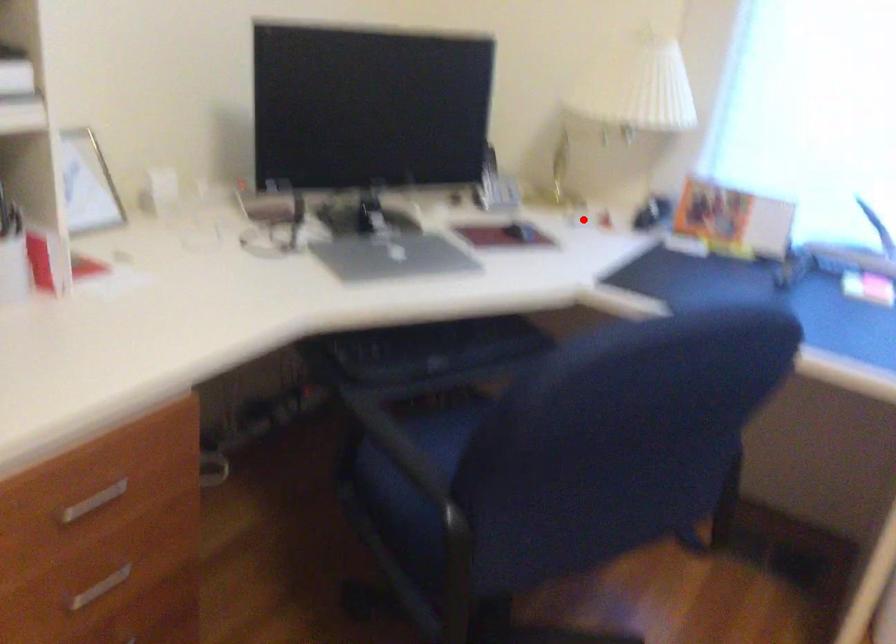
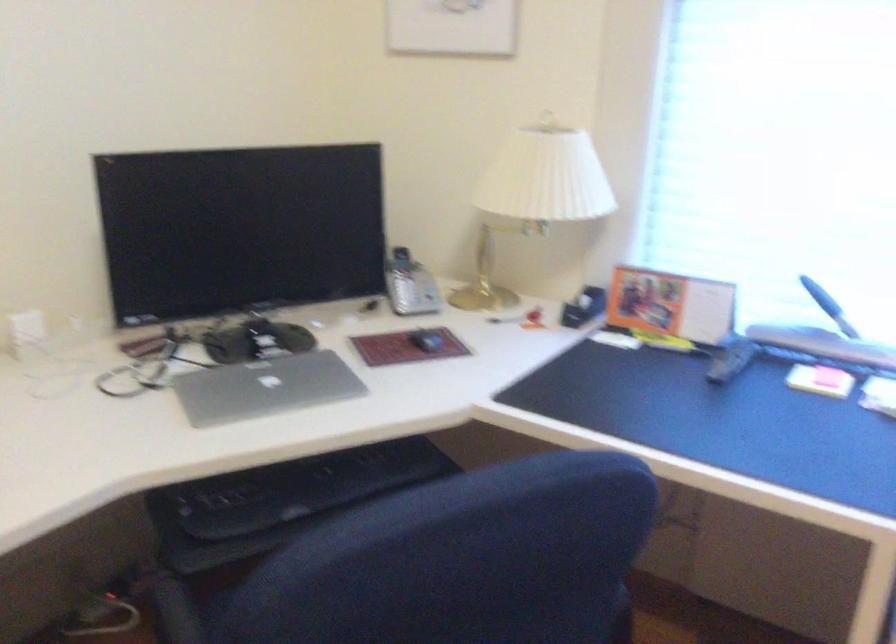
Question: A red point is marked in image1. In image2, is the corresponding 3D point closer to the camera or farther? Reply with the corresponding letter.

Choices:
 (A) The corresponding 3D point is closer.
 (B) The corresponding 3D point is farther.

Answer: (A)